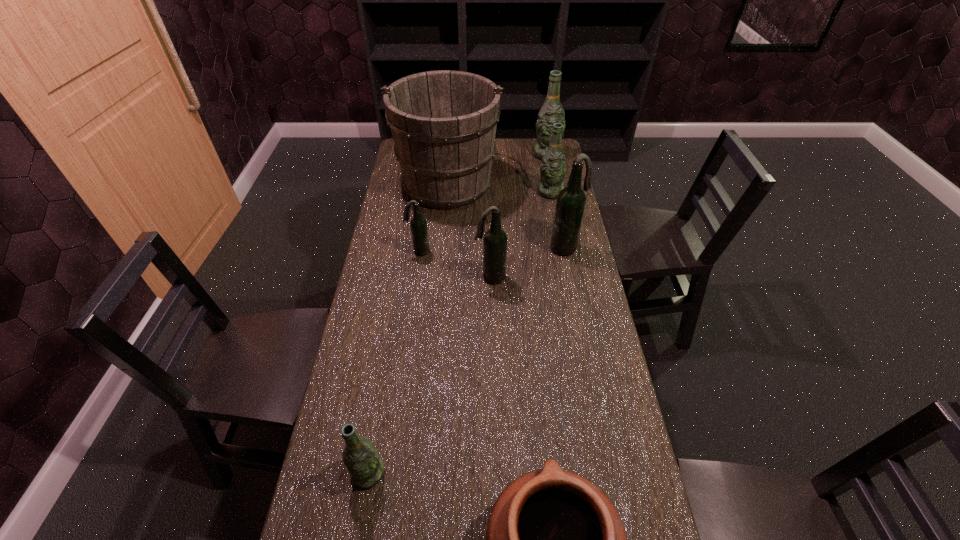
Where is `the smallest green beer bottle`? the smallest green beer bottle is located at coordinates (366, 468).

At what (x,y) coordinates should I click in order to perform the action: click on free space located on the handle side of the bucket. Please return your answer as a coordinate pair (x, y). Looking at the image, I should click on (451, 146).

The image size is (960, 540). What are the coordinates of `free location located 0.210m on the surface of the farthest beer bottle` in the screenshot? It's located at (554, 189).

Identify the location of free space located on the back of the biggest dark beer bottle. 562,226.

Where is `vacant space situated on the surface of the second farthest beer bottle`? This screenshot has height=540, width=960. vacant space situated on the surface of the second farthest beer bottle is located at coordinates (556, 223).

Where is `blank space located on the back of the sixth farthest object`? blank space located on the back of the sixth farthest object is located at coordinates (490, 246).

Locate an element on the screen. free space located on the left of the leftmost dark beer bottle is located at coordinates (377, 251).

Find the location of `free space located 0.080m on the surface of the leftmost green beer bottle`. free space located 0.080m on the surface of the leftmost green beer bottle is located at coordinates (359, 529).

Where is `bucket located in the far edge section of the desktop`? bucket located in the far edge section of the desktop is located at coordinates (443, 123).

At what (x,y) coordinates should I click in order to perform the action: click on beer bottle at the far edge. Please return your answer as a coordinate pair (x, y). The image size is (960, 540). Looking at the image, I should click on (552, 111).